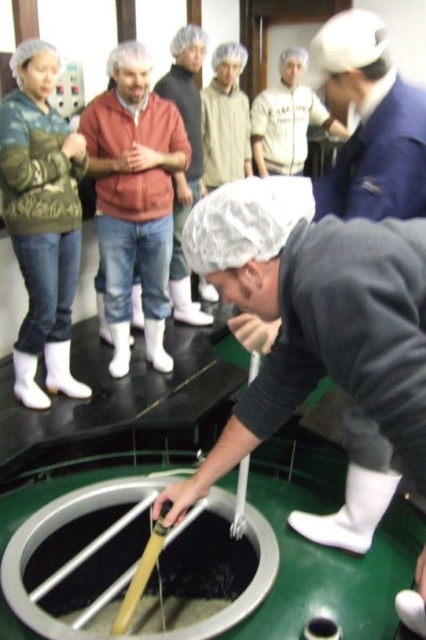
Is point (393, 433) positioned before point (138, 209)?

Yes, it is in front of point (138, 209).

Can you confirm if white matte hairnet at center is positioned above matte orange jacket at center?

Actually, white matte hairnet at center is below matte orange jacket at center.

Is point (408, 320) farther from viewer compared to point (120, 182)?

No, it is in front of (120, 182).

At what (x,y) coordinates should I click in order to perform the action: click on white matte hairnet at center. Please return your answer as a coordinate pair (x, y). The height and width of the screenshot is (640, 426). Looking at the image, I should click on (313, 316).

Does camouflage-patterned jacket at upper left have a smaller size compared to white hairnet at center?

Actually, camouflage-patterned jacket at upper left might be larger than white hairnet at center.

What do you see at coordinates (42, 220) in the screenshot? I see `camouflage-patterned jacket at upper left` at bounding box center [42, 220].

Who is more forward, (34, 381) or (290, 138)?

Point (34, 381) is in front.

Identify the location of camouflage-patterned jacket at upper left. (42, 220).

Can you confirm if matte orange jacket at center is positioned above white hairnet at center?

No.

How far apart are matte orange jacket at center and white hairnet at center?

matte orange jacket at center is 5.29 feet from white hairnet at center.

Identify the location of matte orange jacket at center. The width and height of the screenshot is (426, 640). (135, 196).

This screenshot has height=640, width=426. What are the coordinates of `matte orange jacket at center` in the screenshot? It's located at (135, 196).